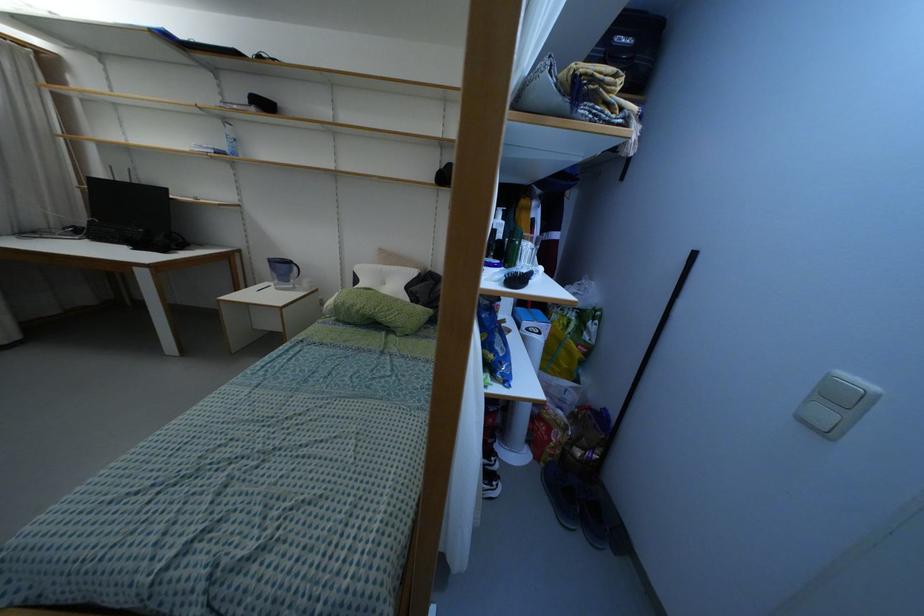
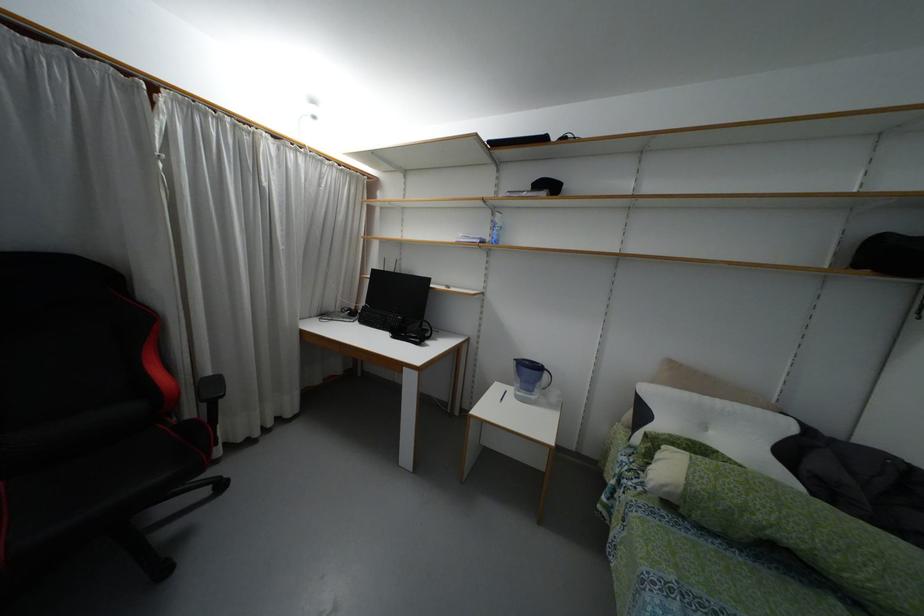
The point at (225, 120) is marked in the first image. Where is the corresponding point in the second image?

(493, 209)